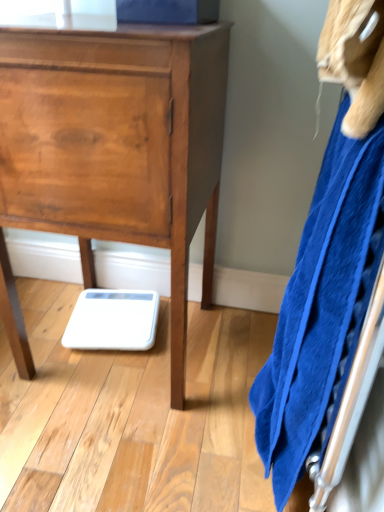
Question: Looking at their shapes, would you say wooden chest of drawers at center is wider or thinner than blue soft towel at right?

Choices:
 (A) wide
 (B) thin

Answer: (A)

Question: Is wooden chest of drawers at center inside the boundaries of blue soft towel at right, or outside?

Choices:
 (A) outside
 (B) inside

Answer: (A)

Question: Is wooden chest of drawers at center taller or shorter than blue soft towel at right?

Choices:
 (A) short
 (B) tall

Answer: (A)

Question: In the image, is blue soft towel at right positioned in front of or behind wooden chest of drawers at center?

Choices:
 (A) behind
 (B) front

Answer: (B)

Question: In terms of width, does blue soft towel at right look wider or thinner when compared to wooden chest of drawers at center?

Choices:
 (A) thin
 (B) wide

Answer: (A)

Question: Considering the positions of point (256, 391) and point (99, 182), is point (256, 391) closer or farther from the camera than point (99, 182)?

Choices:
 (A) closer
 (B) farther

Answer: (B)

Question: From a real-world perspective, is blue soft towel at right positioned above or below wooden chest of drawers at center?

Choices:
 (A) above
 (B) below

Answer: (A)